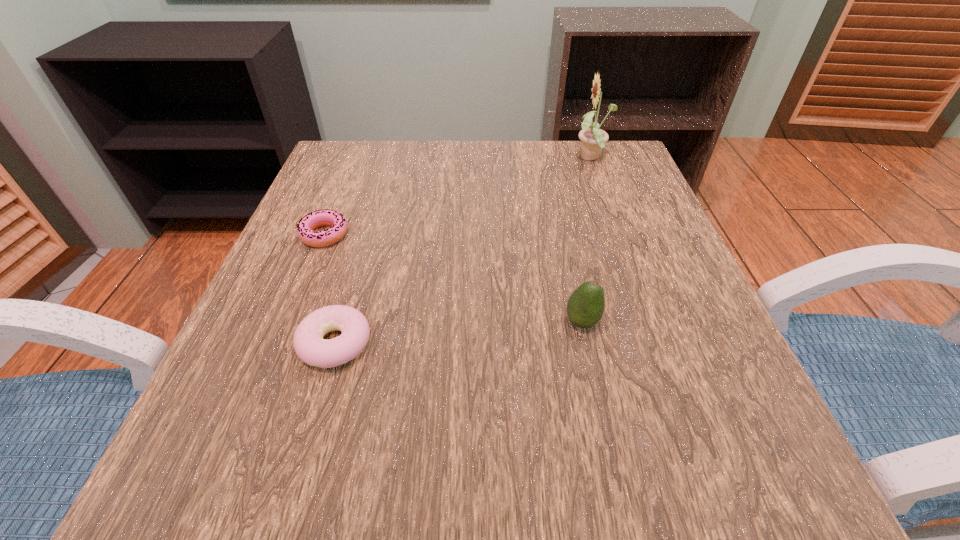
You are a GUI agent. You are given a task and a screenshot of the screen. Output one action in this format:
    pyautogui.click(x=<x>, y=<y>)
    Task: Click on the vacant space positioned on the front-facing side of the rightmost object
    The width and height of the screenshot is (960, 540).
    Given the screenshot: What is the action you would take?
    pyautogui.click(x=408, y=159)

Where is `blank space located 0.050m on the left of the avocado`? The height and width of the screenshot is (540, 960). blank space located 0.050m on the left of the avocado is located at coordinates (533, 322).

Locate an element on the screen. free space located 0.110m on the front of the taller doughnut is located at coordinates (304, 448).

The width and height of the screenshot is (960, 540). What are the coordinates of `free spot located on the right of the third nearest object` in the screenshot? It's located at (430, 235).

Where is `object positioned at the far edge`? The image size is (960, 540). object positioned at the far edge is located at coordinates (592, 139).

This screenshot has height=540, width=960. In order to click on object located in the right edge section of the desktop in this screenshot , I will do `click(592, 139)`.

Locate an element on the screen. Image resolution: width=960 pixels, height=540 pixels. object positioned at the far right corner is located at coordinates (592, 139).

The height and width of the screenshot is (540, 960). I want to click on vacant point at the far edge, so (519, 163).

Find the location of a particular element. The height and width of the screenshot is (540, 960). free space at the near edge of the desktop is located at coordinates (502, 456).

At what (x,y) coordinates should I click in order to perform the action: click on free space at the left edge of the desktop. Please return your answer as a coordinate pair (x, y). Image resolution: width=960 pixels, height=540 pixels. Looking at the image, I should click on (372, 218).